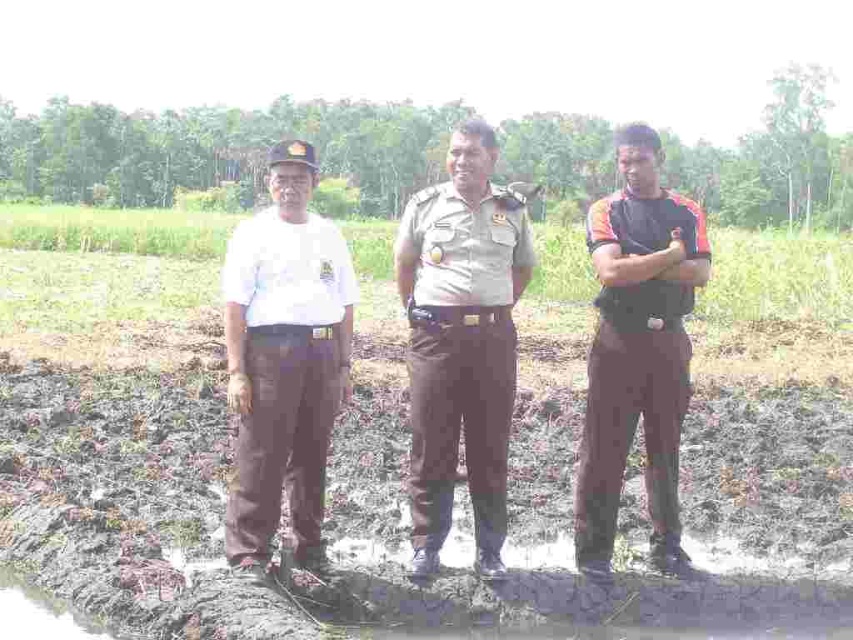
Who is positioned more to the left, light brown uniform at center or dark brown uniform at center?

light brown uniform at center

Is light brown uniform at center shorter than dark brown uniform at center?

Yes, light brown uniform at center is shorter than dark brown uniform at center.

Does point (432, 552) lie behind point (619, 225)?

That is False.

Image resolution: width=853 pixels, height=640 pixels. In order to click on light brown uniform at center in this screenshot , I will do `click(461, 342)`.

Measure the distance from light brown uniform at center to white matte shirt at center.

The distance of light brown uniform at center from white matte shirt at center is 39.29 inches.

Looking at this image, is light brown uniform at center closer to camera compared to white matte shirt at center?

No, it is behind white matte shirt at center.

Which is in front, point (427, 328) or point (260, 276)?

Point (260, 276) is more forward.

This screenshot has width=853, height=640. I want to click on light brown uniform at center, so click(461, 342).

Who is more distant from viewer, [264,280] or [608,552]?

The point [608,552] is more distant.

Between white matte shirt at center and dark brown uniform at center, which one has more height?

dark brown uniform at center is taller.

Is point (258, 464) farther from camera compared to point (660, 342)?

That is False.

Find the location of a particular element. This screenshot has height=640, width=853. white matte shirt at center is located at coordinates (283, 362).